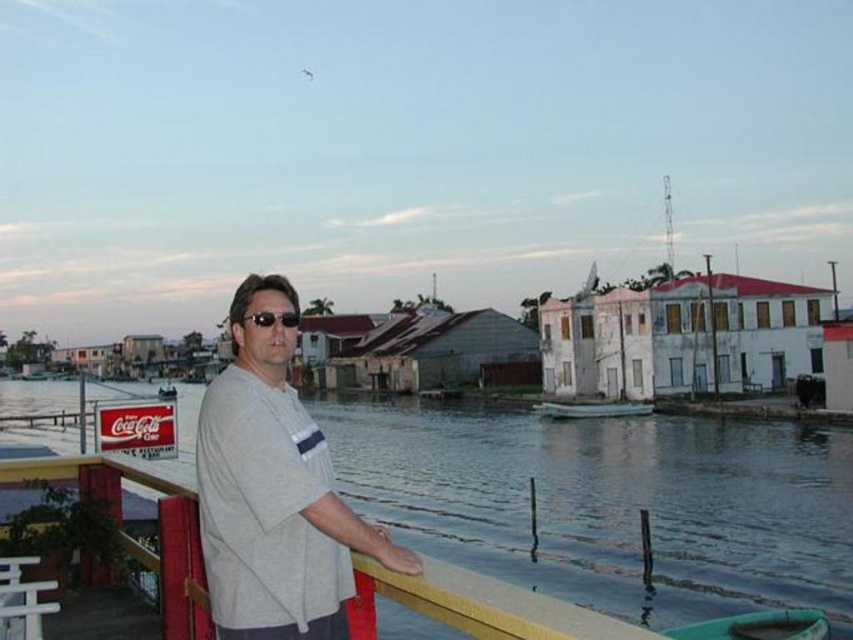
You are a photographer trying to capture the white matte boat at center and the matte black sunglasses at center in the same frame. Based on their sizes, which object will appear larger in your photo?

The white matte boat at center will appear larger in the photo because its width is larger than the matte black sunglasses at center.

You are a photographer trying to capture both the white matte boat at center and the matte black sunglasses at center in a single frame. Based on their positions, can you determine which object is closer to the camera?

The matte black sunglasses at center is behind the white matte boat at center, so the boat is closer to the camera than the sunglasses.